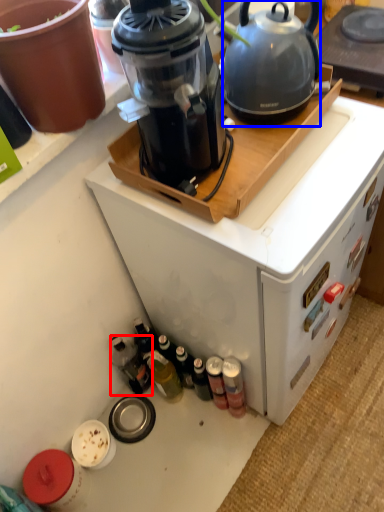
Question: Which object is further to the camera taking this photo, bottle (highlighted by a red box) or kettle (highlighted by a blue box)?

Choices:
 (A) bottle
 (B) kettle

Answer: (A)